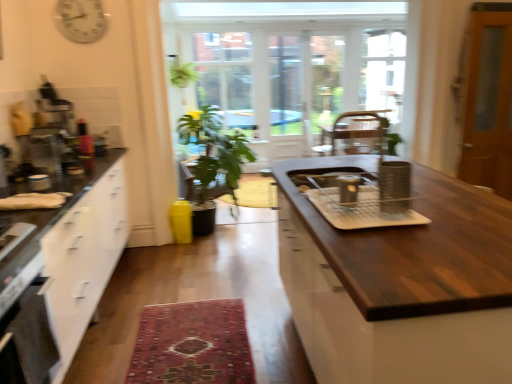
Question: Considering the relative sizes of dark wood countertop at center and green matte plant at center in the image provided, is dark wood countertop at center wider than green matte plant at center?

Choices:
 (A) yes
 (B) no

Answer: (A)

Question: From the image's perspective, is dark wood countertop at center on green matte plant at center?

Choices:
 (A) no
 (B) yes

Answer: (A)

Question: Is dark wood countertop at center in front of green matte plant at center?

Choices:
 (A) yes
 (B) no

Answer: (A)

Question: Does dark wood countertop at center turn towards green matte plant at center?

Choices:
 (A) yes
 (B) no

Answer: (B)

Question: Considering the relative sizes of dark wood countertop at center and green matte plant at center in the image provided, is dark wood countertop at center taller than green matte plant at center?

Choices:
 (A) yes
 (B) no

Answer: (B)

Question: From a real-world perspective, is dark wood countertop at center above or below white glossy clock at upper left?

Choices:
 (A) below
 (B) above

Answer: (A)

Question: Considering the positions of dark wood countertop at center and white glossy clock at upper left in the image, is dark wood countertop at center taller or shorter than white glossy clock at upper left?

Choices:
 (A) short
 (B) tall

Answer: (B)

Question: Is point (499, 269) closer or farther from the camera than point (87, 33)?

Choices:
 (A) farther
 (B) closer

Answer: (B)

Question: Looking at their shapes, would you say dark wood countertop at center is wider or thinner than white glossy clock at upper left?

Choices:
 (A) wide
 (B) thin

Answer: (A)

Question: Looking at the image, does green matte plant at center seem bigger or smaller compared to metallic silver coffee machine at left, placed as the first appliance when sorted from left to right?

Choices:
 (A) small
 (B) big

Answer: (B)

Question: From a real-world perspective, is green matte plant at center above or below metallic silver coffee machine at left, placed as the fifth appliance when sorted from right to left?

Choices:
 (A) above
 (B) below

Answer: (B)

Question: From the image's perspective, relative to metallic silver coffee machine at left, placed as the fifth appliance when sorted from right to left, is green matte plant at center above or below?

Choices:
 (A) above
 (B) below

Answer: (B)

Question: Considering the positions of green matte plant at center and metallic silver coffee machine at left, placed as the first appliance when sorted from left to right, in the image, is green matte plant at center taller or shorter than metallic silver coffee machine at left, placed as the first appliance when sorted from left to right,?

Choices:
 (A) tall
 (B) short

Answer: (A)

Question: In terms of size, does carpeted rug at center appear bigger or smaller than white glossy clock at upper left?

Choices:
 (A) small
 (B) big

Answer: (B)

Question: Is carpeted rug at center in front of or behind white glossy clock at upper left in the image?

Choices:
 (A) front
 (B) behind

Answer: (A)